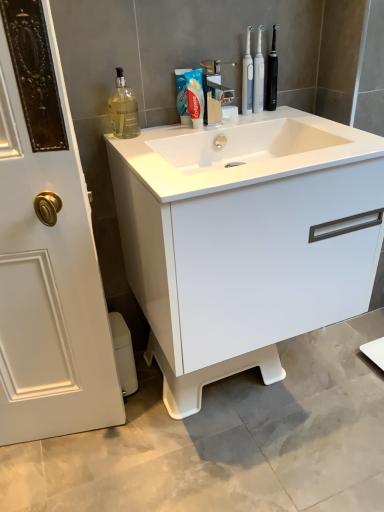
Question: Looking at their shapes, would you say white glossy cabinet at center is wider or thinner than white glossy sink at center?

Choices:
 (A) thin
 (B) wide

Answer: (A)

Question: Considering the positions of white glossy cabinet at center and white glossy sink at center in the image, is white glossy cabinet at center bigger or smaller than white glossy sink at center?

Choices:
 (A) big
 (B) small

Answer: (A)

Question: Estimate the real-world distances between objects in this image. Which object is farther from the white matte toothpaste at center?

Choices:
 (A) clear plastic toothbrushes at upper center
 (B) translucent glass bottle at upper left
 (C) white plastic toilet bowl at lower left
 (D) white glossy cabinet at center
 (E) matte white electric toothbrushes at upper center, placed as the second toiletry when sorted from right to left

Answer: (C)

Question: Estimate the real-world distances between objects in this image. Which object is farther from the matte white electric toothbrushes at upper center, placed as the second toiletry when sorted from right to left?

Choices:
 (A) white glossy cabinet at center
 (B) black plastic toothbrush at upper right, the 1th toiletry when ordered from right to left
 (C) white matte toothpaste at center
 (D) clear plastic toothbrushes at upper center
 (E) white plastic toilet bowl at lower left

Answer: (E)